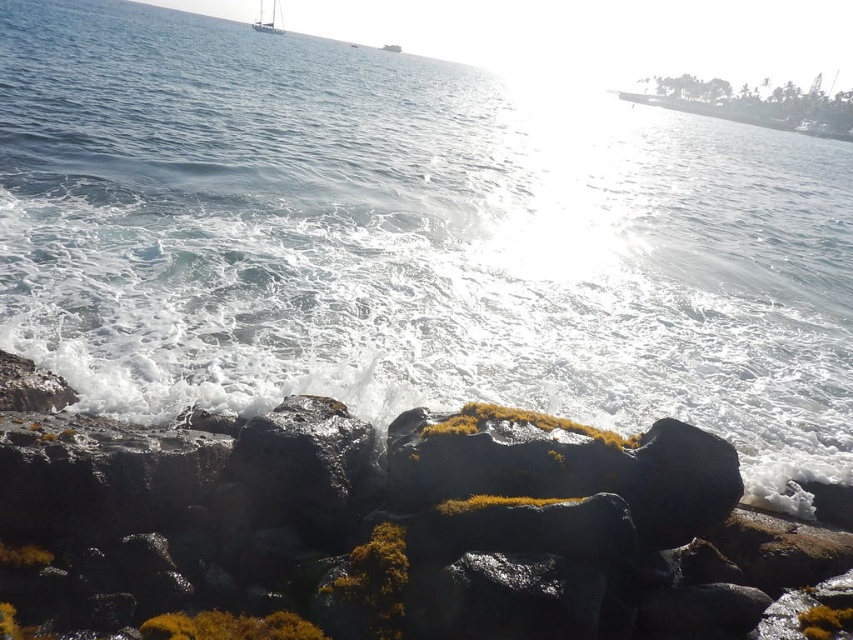
You are a photographer standing on the rocky shore and want to capture both the rough volcanic rock at lower center and the white glossy sailboat at upper center in the same frame. Which object should you position closer to the left side of your camera viewfinder to ensure both are included?

You should position the white glossy sailboat at upper center closer to the left side of your camera viewfinder because the rough volcanic rock at lower center is on the right side of it.

You are standing on the rocky shore and want to take a photo of the white glossy sailboat at upper center without the rough volcanic rock at lower center blocking the view. Is the sailboat visible from your current position?

The rough volcanic rock at lower center is in front of the white glossy sailboat at upper center, so the sailboat may be partially or fully blocked from your current viewpoint.

You are standing on the rocky shore and see the rough volcanic rock at lower center and the white glossy sailboat at upper center. Which object is closer to you?

The rough volcanic rock at lower center is closer to you because it is positioned under the white glossy sailboat at upper center, indicating a lower and nearer placement in the scene.